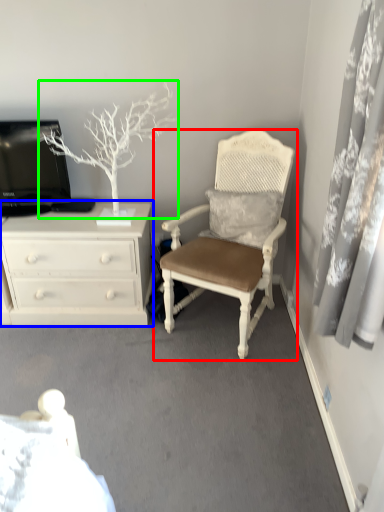
Question: Which is nearer to the chair (highlighted by a red box)? chest of drawers (highlighted by a blue box) or tree (highlighted by a green box).

Choices:
 (A) chest of drawers
 (B) tree

Answer: (A)